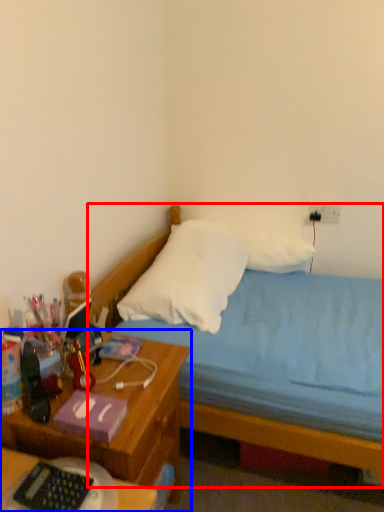
Question: Which object appears farthest to the camera in this image, bed (highlighted by a red box) or nightstand (highlighted by a blue box)?

Choices:
 (A) bed
 (B) nightstand

Answer: (A)